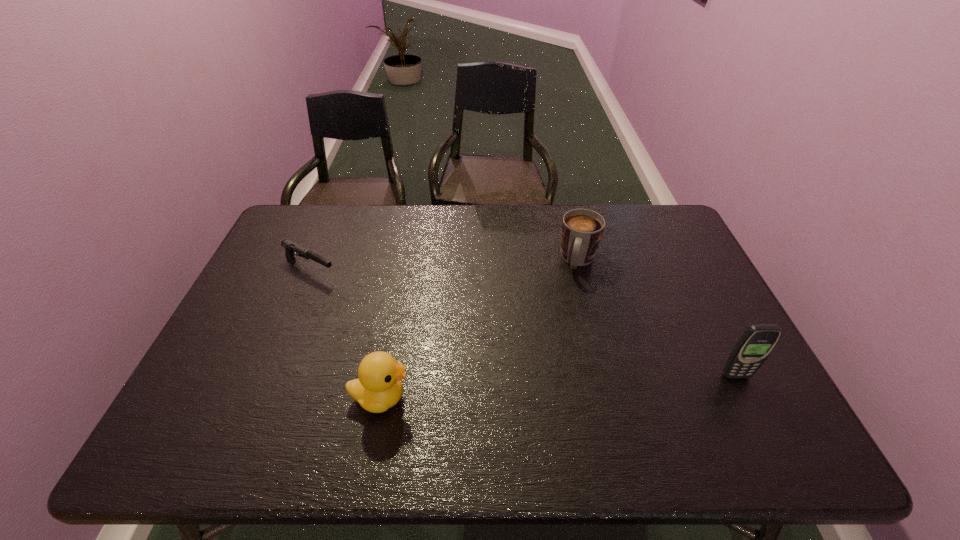
In the image, there is a desktop. Identify the location of free region at the right edge. The width and height of the screenshot is (960, 540). (693, 259).

In the image, there is a desktop. Identify the location of vacant space at the far left corner. (318, 224).

Locate an element on the screen. The image size is (960, 540). vacant region at the far right corner of the desktop is located at coordinates (633, 229).

The image size is (960, 540). I want to click on vacant space at the near right corner of the desktop, so click(714, 404).

Identify the location of free space between the third object from left to right and the shortest object. (444, 265).

Where is `unoccupied area between the shortest object and the second object from right to left`? The image size is (960, 540). unoccupied area between the shortest object and the second object from right to left is located at coordinates (444, 265).

The height and width of the screenshot is (540, 960). Identify the location of free space between the tallest object and the leftmost object. [x=523, y=322].

You are a GUI agent. You are given a task and a screenshot of the screen. Output one action in this format:
    pyautogui.click(x=<x>, y=<y>)
    Task: Click on the free space between the third object from left to right and the tallest object
    The image size is (960, 540).
    Given the screenshot: What is the action you would take?
    pyautogui.click(x=658, y=318)

The height and width of the screenshot is (540, 960). In order to click on vacant area that lies between the rightmost object and the gun in this screenshot , I will do `click(523, 322)`.

The height and width of the screenshot is (540, 960). I want to click on free space between the third object from right to left and the rightmost object, so click(x=558, y=387).